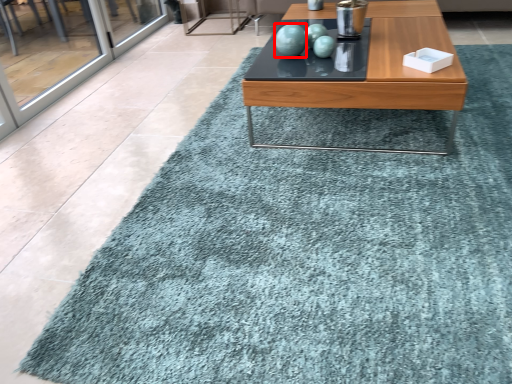
Question: From the image, what is the correct spatial relationship of turquoise (annotated by the red box) in relation to coffee table?

Choices:
 (A) right
 (B) left

Answer: (B)